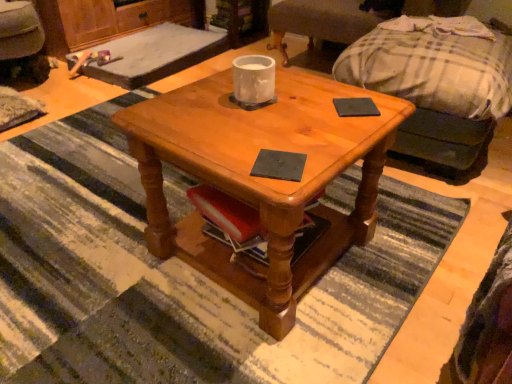
Identify the location of vacant space to the left of black matte coaster at center, which is the first pad from left to right. This screenshot has width=512, height=384. (222, 154).